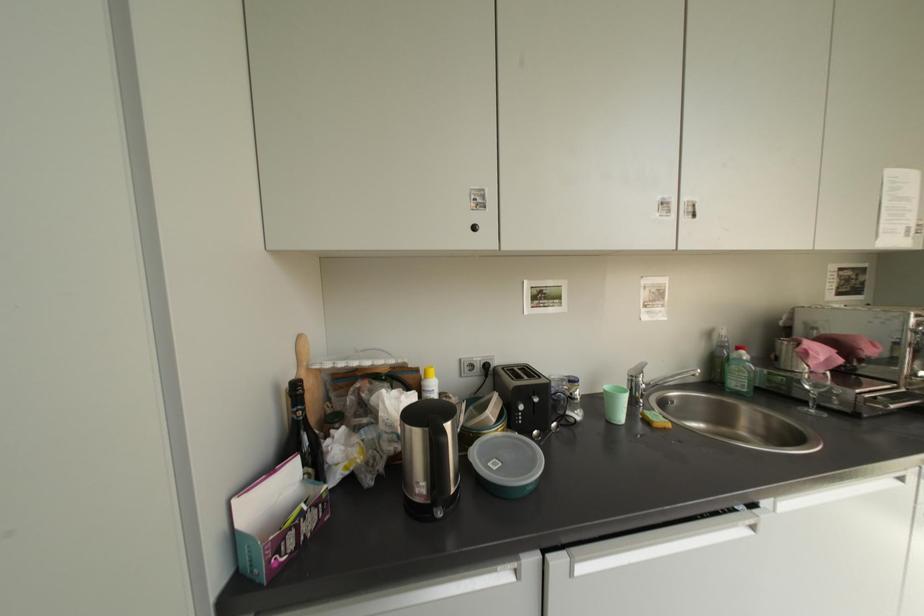
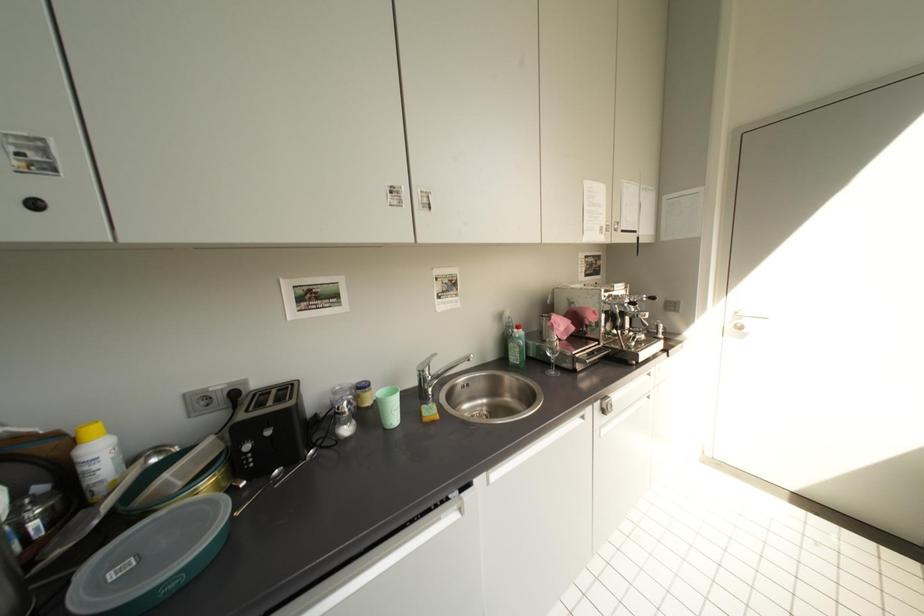
Question: The images are taken continuously from a first-person perspective. In which direction is your viewpoint rotating?

Choices:
 (A) Left
 (B) Right
 (C) Up
 (D) Down

Answer: (B)